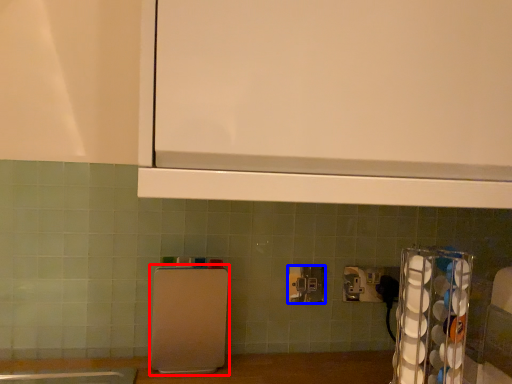
Question: Which object is further to the camera taking this photo, appliance (highlighted by a red box) or power plugs and sockets (highlighted by a blue box)?

Choices:
 (A) appliance
 (B) power plugs and sockets

Answer: (B)